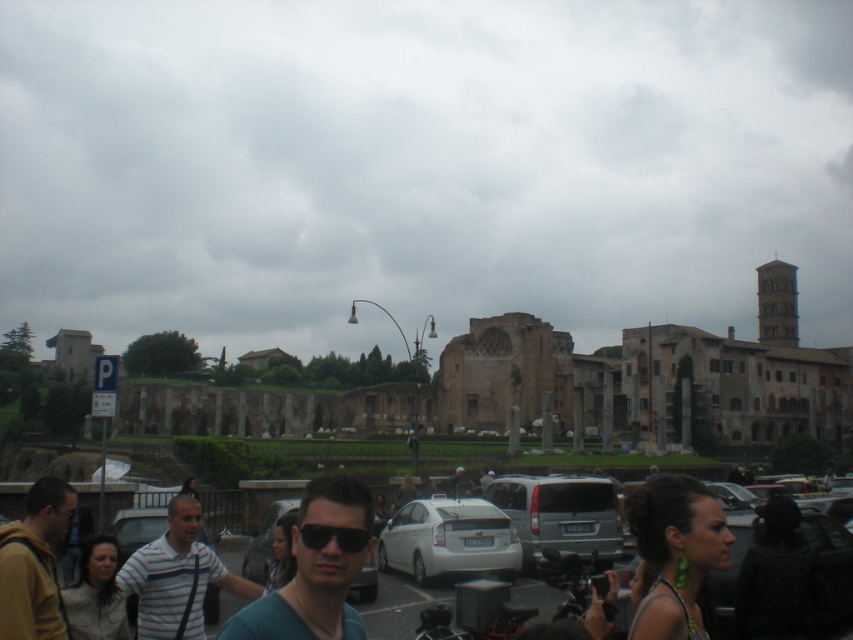
Question: Where is silver metallic van at center located in relation to black plastic goggles at center in the image?

Choices:
 (A) above
 (B) below

Answer: (B)

Question: Can you confirm if striped cotton shirt at center is thinner than white matte car at center?

Choices:
 (A) yes
 (B) no

Answer: (A)

Question: Considering the relative positions of matte black sunglasses at center and silver metallic van at center in the image provided, where is matte black sunglasses at center located with respect to silver metallic van at center?

Choices:
 (A) below
 (B) above

Answer: (A)

Question: Which object is farther from the camera taking this photo?

Choices:
 (A) silver metallic van at center
 (B) white matte car at center

Answer: (A)

Question: Estimate the real-world distances between objects in this image. Which object is closer to the dark brown leather jacket at lower left?

Choices:
 (A) white matte car at center
 (B) brown stone ruins at center

Answer: (A)

Question: Considering the real-world distances, which object is farthest from the matte black sunglasses at center?

Choices:
 (A) striped cotton shirt at center
 (B) silver metallic van at center
 (C) black matte sunglasses at center
 (D) dark brown leather jacket at lower left

Answer: (B)